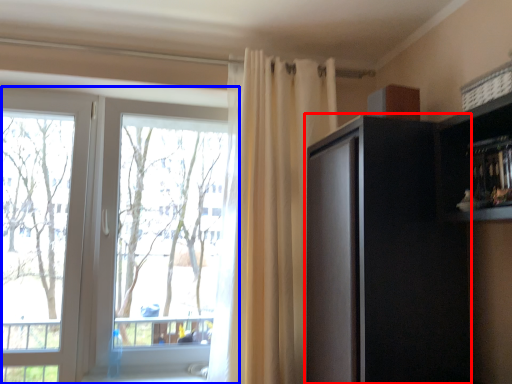
Question: Among these objects, which one is nearest to the camera, cabinetry (highlighted by a red box) or window (highlighted by a blue box)?

Choices:
 (A) cabinetry
 (B) window

Answer: (A)